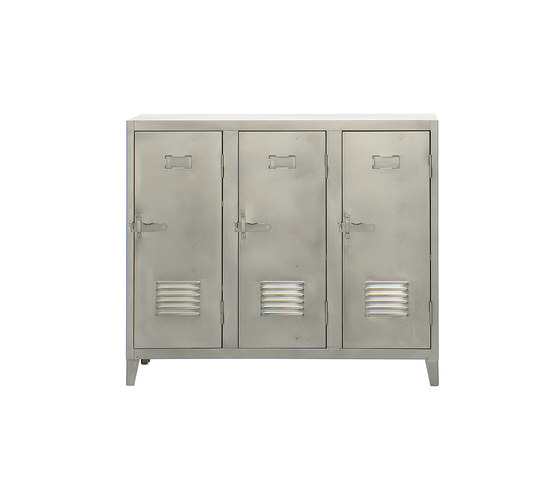
This screenshot has width=560, height=478. What are the coordinates of `ventilation holes` in the screenshot? It's located at (179, 299), (386, 304), (283, 302).